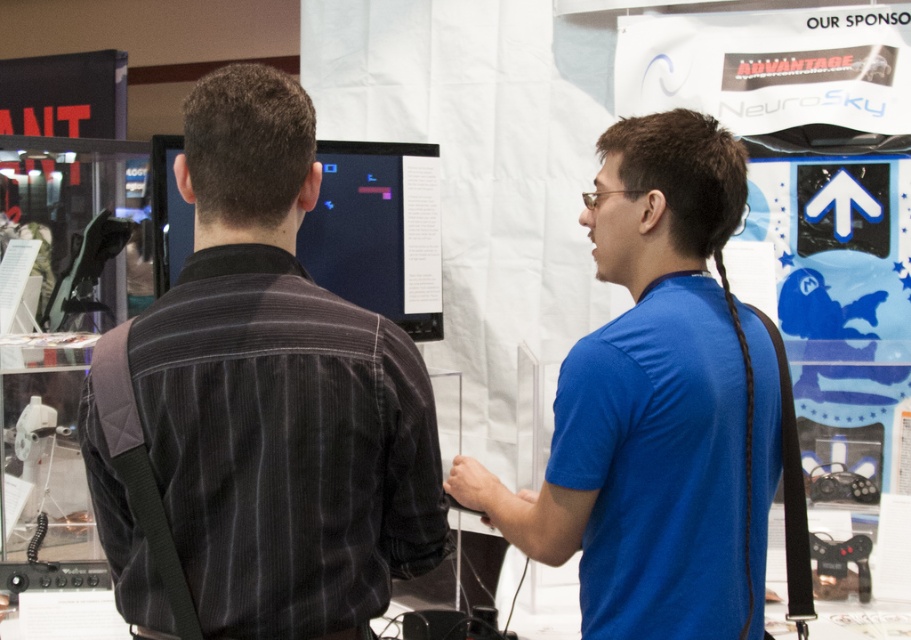
You are organizing a photo shoot and need to arrange two models wearing the dark gray corduroy shirt at center and the blue cotton shirt at center. Based on their sizes, which model should stand closer to the camera to ensure both appear proportionally sized in the photo?

The dark gray corduroy shirt at center is smaller in size compared to the blue cotton shirt at center. To make them appear proportionally sized in the photo, the model wearing the dark gray corduroy shirt at center should stand closer to the camera than the one in the blue cotton shirt at center.

You are a photographer at the event and need to capture a photo of both the dark gray corduroy shirt at center and the blue cotton shirt at center in the same frame. The camera you are using has a minimum focus distance of 16 inches. Can you take the photo without moving either of the subjects?

The dark gray corduroy shirt at center and blue cotton shirt at center are 16.51 inches apart. Since the distance between them is greater than the camera minimum focus distance of 16 inches, you can take the photo without moving either of the subjects.

You are a photographer at the event and want to capture both the dark gray corduroy shirt at center and the blue cotton shirt at center in a single frame. Which shirt should you adjust your camera angle to focus on first to ensure both are in the frame?

The dark gray corduroy shirt at center is thinner than the blue cotton shirt at center, so you should focus on the blue cotton shirt at center first to accommodate its wider width in the frame.